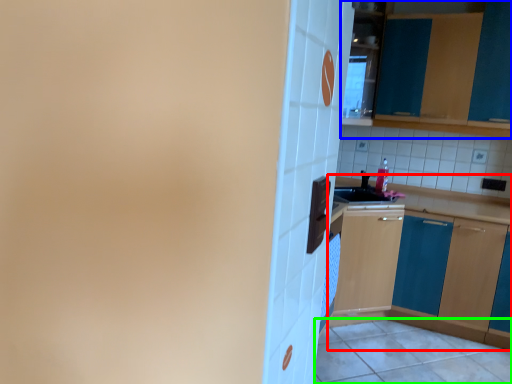
Question: Considering the real-world distances, which object is farthest from cabinetry (highlighted by a red box)? cabinetry (highlighted by a blue box) or tile (highlighted by a green box)?

Choices:
 (A) cabinetry
 (B) tile

Answer: (A)